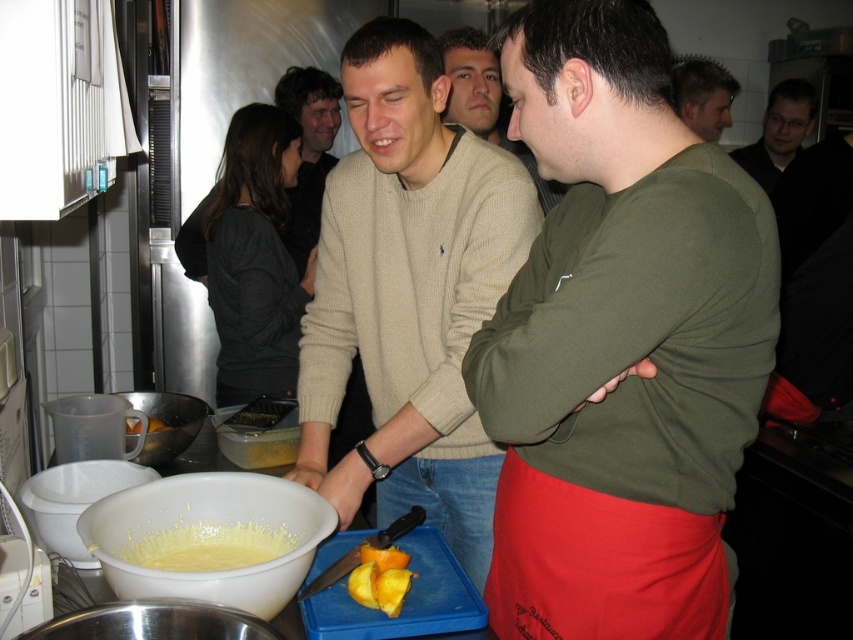
Does white plastic bowl at lower center have a lesser height compared to light brown hair at upper right?

Correct, white plastic bowl at lower center is not as tall as light brown hair at upper right.

Based on the photo, between white plastic bowl at lower center and light brown hair at upper right, which one has more height?

Standing taller between the two is light brown hair at upper right.

Is point (173, 476) in front of point (674, 67)?

Yes, point (173, 476) is in front of point (674, 67).

Where is `white plastic bowl at lower center`? white plastic bowl at lower center is located at coordinates 209,538.

Which is behind, point (299, 102) or point (134, 428)?

The point (299, 102) is behind.

Which is more to the right, matte beige sweater at center or yellow matte orange at lower center?

matte beige sweater at center

At what (x,y) coordinates should I click in order to perform the action: click on matte beige sweater at center. Please return your answer as a coordinate pair (x, y). The width and height of the screenshot is (853, 640). Looking at the image, I should click on (308, 152).

Does light beige sweater at center appear over yellow creamy food at center?

Yes, light beige sweater at center is above yellow creamy food at center.

Which is behind, point (370, 100) or point (252, 424)?

Point (252, 424)

Locate an element on the screen. The width and height of the screenshot is (853, 640). light beige sweater at center is located at coordinates (409, 292).